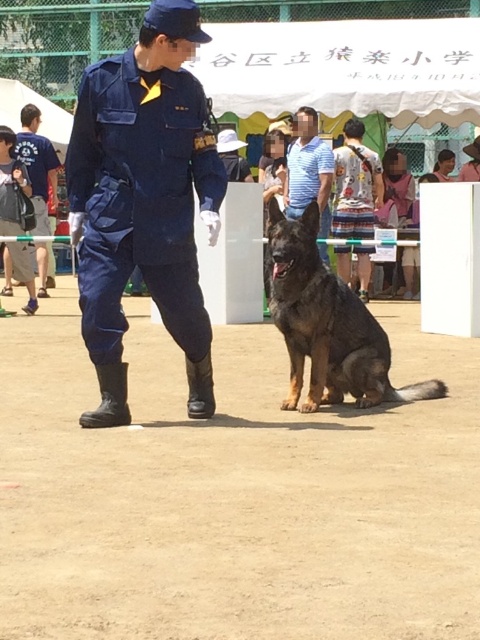
Does dirt field at center lie behind dark brown fur dog at center?

No, it is in front of dark brown fur dog at center.

Is dirt field at center taller than dark brown fur dog at center?

No, dirt field at center is not taller than dark brown fur dog at center.

At what (x,y) coordinates should I click in order to perform the action: click on dirt field at center. Please return your answer as a coordinate pair (x, y). Looking at the image, I should click on (233, 493).

Is dark brown fur dog at center below striped cotton shirt at center?

Indeed, dark brown fur dog at center is positioned under striped cotton shirt at center.

Who is more forward, (305, 252) or (294, 212)?

Point (305, 252) is more forward.

I want to click on dark brown fur dog at center, so click(x=326, y=324).

Does white cotton shirt at center have a greater height compared to blue uniform at left?

Incorrect, white cotton shirt at center's height is not larger of blue uniform at left's.

Does white cotton shirt at center lie in front of blue uniform at left?

No, white cotton shirt at center is further to the viewer.

Between point (345, 220) and point (56, 189), which one is positioned in front?

Point (345, 220)

This screenshot has width=480, height=640. Find the location of `white cotton shirt at center`. white cotton shirt at center is located at coordinates (355, 189).